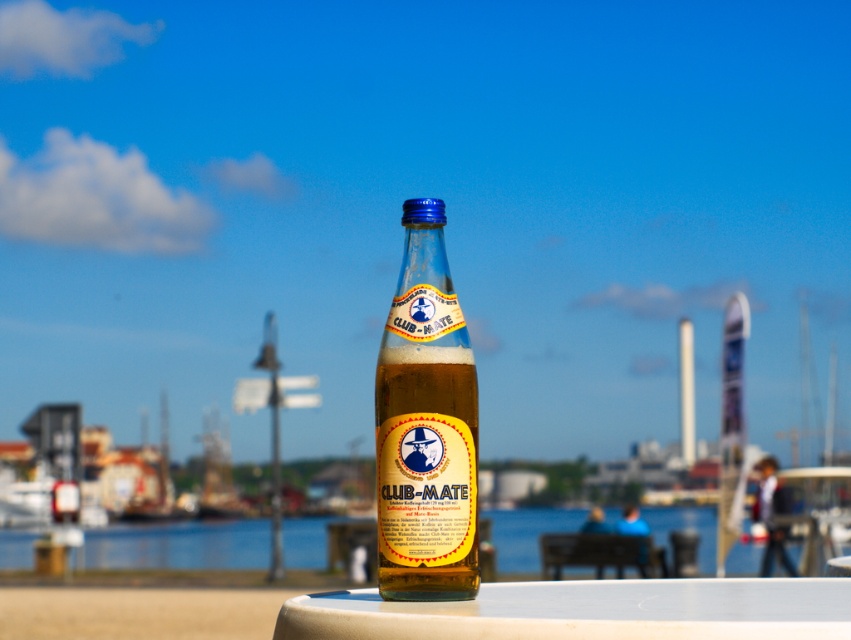
You are at a cafe by the waterfront and want to place your Club Mate bottle on the table. Based on the image, can you tell me if the translucent glass bottle at center is to the left or right of the white plastic table at center?

The translucent glass bottle at center is to the left of the white plastic table at center according to the description.